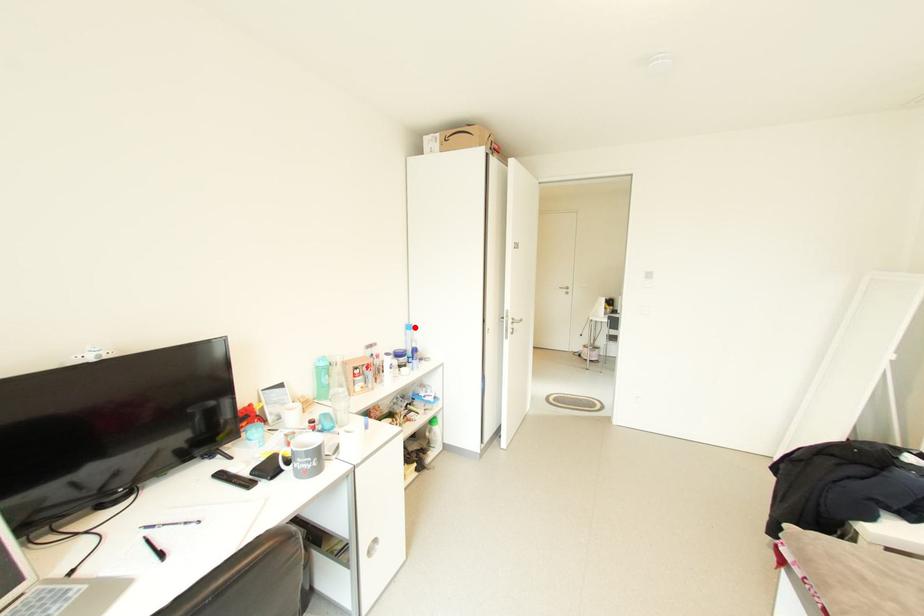
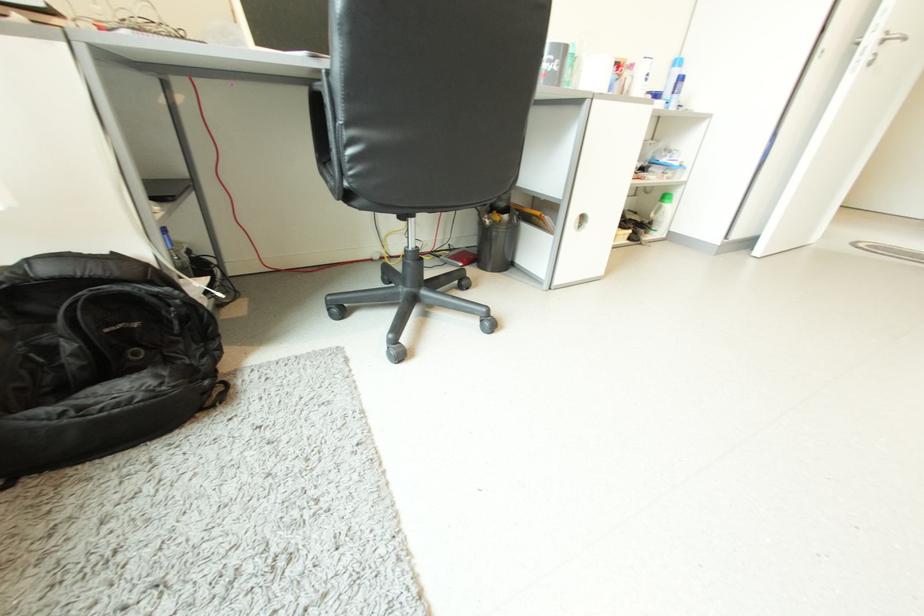
Locate, in the second image, the point that corresponds to the highlighted location in the first image.

(681, 63)